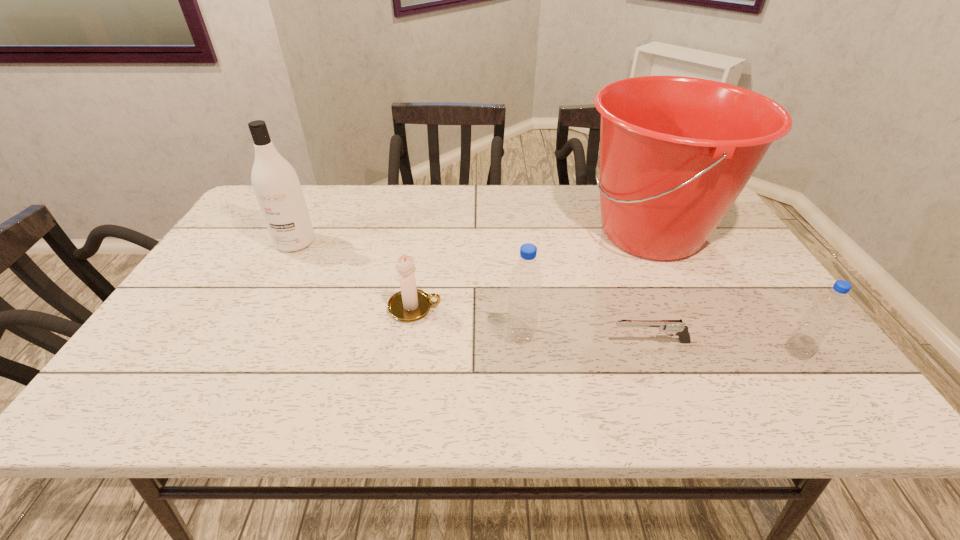
The width and height of the screenshot is (960, 540). Find the location of `vacant region between the leftmost object and the pistol`. vacant region between the leftmost object and the pistol is located at coordinates (473, 292).

At what (x,y) coordinates should I click in order to perform the action: click on vacant space in between the shorter water bottle and the candle holder. Please return your answer as a coordinate pair (x, y). The image size is (960, 540). Looking at the image, I should click on (606, 330).

Where is `vacant point located between the pistol and the fourth tallest object`? The image size is (960, 540). vacant point located between the pistol and the fourth tallest object is located at coordinates (724, 347).

Identify the location of free space that is in between the shortest object and the fourth object from right to left. This screenshot has height=540, width=960. (586, 339).

Locate an element on the screen. free point between the shorter water bottle and the leftmost object is located at coordinates (546, 297).

Where is `vacant space in between the right water bottle and the shampoo`? Image resolution: width=960 pixels, height=540 pixels. vacant space in between the right water bottle and the shampoo is located at coordinates (546, 297).

Find the location of a particular element. vacant region between the shortest object and the right water bottle is located at coordinates (724, 347).

Locate an element on the screen. This screenshot has height=540, width=960. free space that is in between the left water bottle and the candle holder is located at coordinates (468, 321).

Locate an element on the screen. the closest object relative to the shampoo is located at coordinates (410, 304).

Identify which object is the fourth closest to the bucket. Please provide its 2D coordinates. Your answer should be formatted as a tuple, i.e. [(x, y)], where the tuple contains the x and y coordinates of a point satisfying the conditions above.

[(410, 304)]